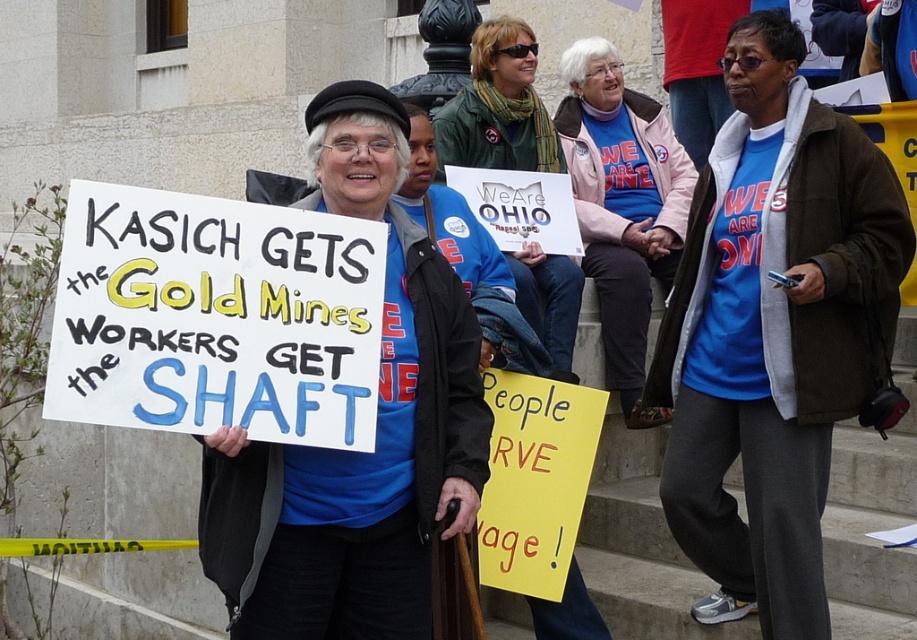
You are organizing a photo shoot and need to ensure that the two blue shirts in the scene are visible in the final image. Given that the matte blue shirt at center is wider than the blue cotton shirt at center, which shirt should you focus on to ensure both are fully visible in the frame?

The matte blue shirt at center is wider than the blue cotton shirt at center, so focusing on the matte blue shirt at center ensures that both shirts are fully visible in the frame.

You are a photographer trying to capture the protestor with the sign in the center. The protestor is standing at point [376,429]. What color is the shirt of the protestor at this point?

The protestor at point [376,429] is wearing a matte blue shirt.